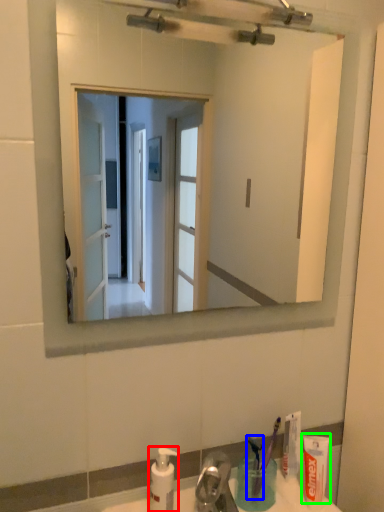
Question: Which object is the farthest from soap dispenser (highlighted by a red box)? Choose among these: toothbrush (highlighted by a blue box) or toothpaste (highlighted by a green box).

Choices:
 (A) toothbrush
 (B) toothpaste

Answer: (B)